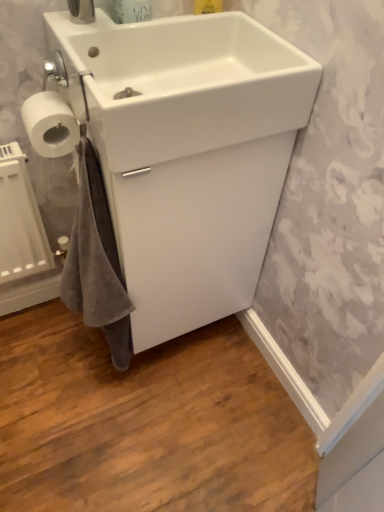
Question: Does white glossy sink at upper center, the 2th sink in the back-to-front sequence, come in front of white matte toilet paper at left?

Choices:
 (A) no
 (B) yes

Answer: (B)

Question: Would you say white glossy sink at upper center, the 2th sink in the back-to-front sequence, contains white matte toilet paper at left?

Choices:
 (A) yes
 (B) no

Answer: (B)

Question: From the image's perspective, does white glossy sink at upper center, the 1th sink viewed from the front, appear higher than white matte toilet paper at left?

Choices:
 (A) yes
 (B) no

Answer: (A)

Question: Considering the relative positions of white glossy sink at upper center, the 1th sink viewed from the front, and white matte toilet paper at left in the image provided, is white glossy sink at upper center, the 1th sink viewed from the front, to the right of white matte toilet paper at left from the viewer's perspective?

Choices:
 (A) yes
 (B) no

Answer: (A)

Question: Is white glossy sink at upper center, the 1th sink viewed from the front, further to camera compared to white matte toilet paper at left?

Choices:
 (A) yes
 (B) no

Answer: (B)

Question: From a real-world perspective, relative to white glossy sink at upper center, the 1th sink viewed from the front, is white glossy sink at center, the 1th sink when ordered from back to front, vertically above or below?

Choices:
 (A) above
 (B) below

Answer: (B)

Question: Is point click(129, 88) closer or farther from the camera than point click(112, 75)?

Choices:
 (A) closer
 (B) farther

Answer: (A)

Question: Considering their positions, is white glossy sink at center, the 1th sink when ordered from back to front, located in front of or behind white glossy sink at upper center, the 2th sink in the back-to-front sequence?

Choices:
 (A) behind
 (B) front

Answer: (A)

Question: Considering the positions of white glossy sink at center, marked as the second sink in a front-to-back arrangement, and white glossy sink at upper center, the 1th sink viewed from the front, in the image, is white glossy sink at center, marked as the second sink in a front-to-back arrangement, bigger or smaller than white glossy sink at upper center, the 1th sink viewed from the front,?

Choices:
 (A) big
 (B) small

Answer: (A)

Question: Is white glossy sink at upper center, the 1th sink viewed from the front, taller or shorter than white matte toilet paper at left?

Choices:
 (A) tall
 (B) short

Answer: (A)

Question: Based on their sizes in the image, would you say white glossy sink at upper center, the 2th sink in the back-to-front sequence, is bigger or smaller than white matte toilet paper at left?

Choices:
 (A) small
 (B) big

Answer: (B)

Question: Would you say white glossy sink at upper center, the 2th sink in the back-to-front sequence, is to the left or to the right of white matte toilet paper at left in the picture?

Choices:
 (A) right
 (B) left

Answer: (A)

Question: Is white glossy sink at upper center, the 2th sink in the back-to-front sequence, in front of or behind white matte toilet paper at left in the image?

Choices:
 (A) front
 (B) behind

Answer: (A)

Question: From the image's perspective, relative to white glossy sink at center, the 1th sink when ordered from back to front, is white glossy sink at upper center, the 1th sink viewed from the front, above or below?

Choices:
 (A) above
 (B) below

Answer: (A)

Question: Is white glossy sink at upper center, the 1th sink viewed from the front, inside the boundaries of white glossy sink at center, marked as the second sink in a front-to-back arrangement, or outside?

Choices:
 (A) inside
 (B) outside

Answer: (B)